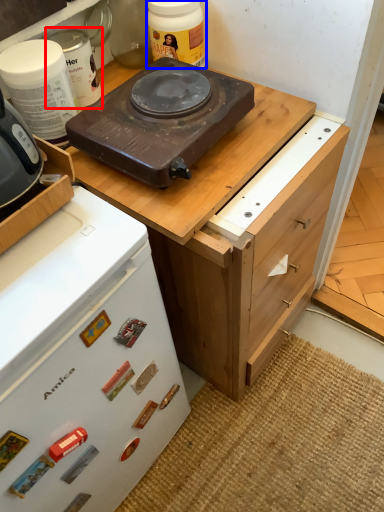
Question: Which object appears closest to the camera in this image, kitchen appliance (highlighted by a red box) or kitchen appliance (highlighted by a blue box)?

Choices:
 (A) kitchen appliance
 (B) kitchen appliance

Answer: (A)